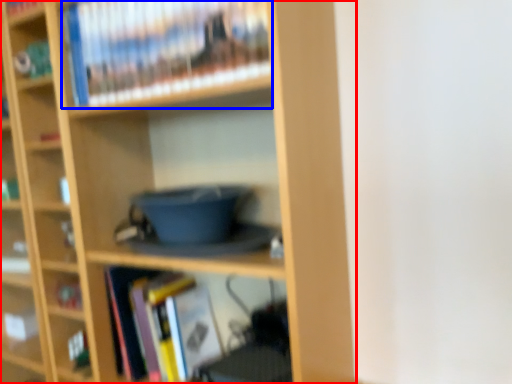
Question: Which of the following is the closest to the observer, bookcase (highlighted by a red box) or book (highlighted by a blue box)?

Choices:
 (A) bookcase
 (B) book

Answer: (A)